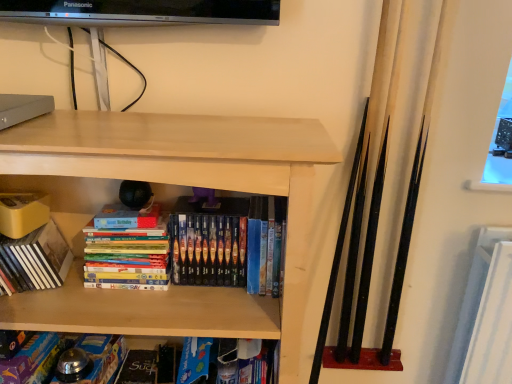
Where is `free point above blue cardboard book at lower center, arranged as the 2th book when viewed from the left (from a real-world perspective)`? The height and width of the screenshot is (384, 512). free point above blue cardboard book at lower center, arranged as the 2th book when viewed from the left (from a real-world perspective) is located at coordinates (77, 351).